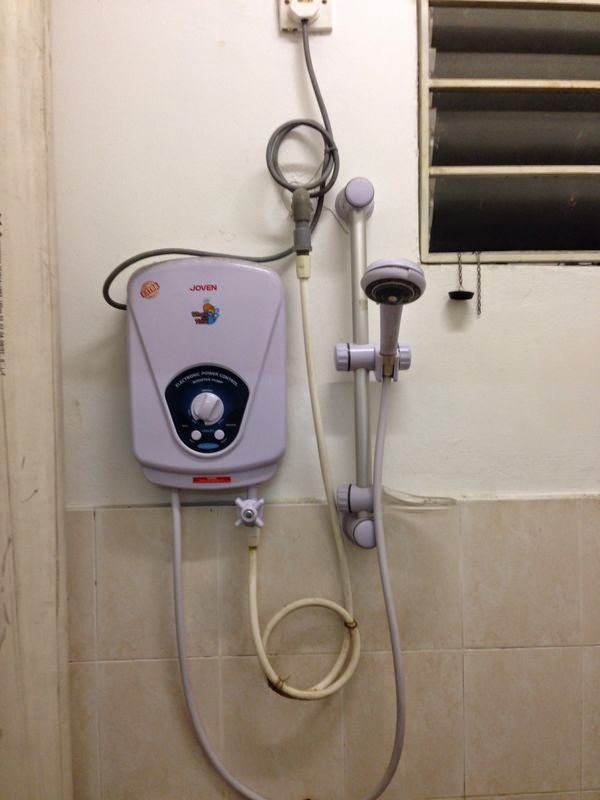
Where is `thick white wire`? The image size is (600, 800). thick white wire is located at coordinates (332, 685), (327, 469).